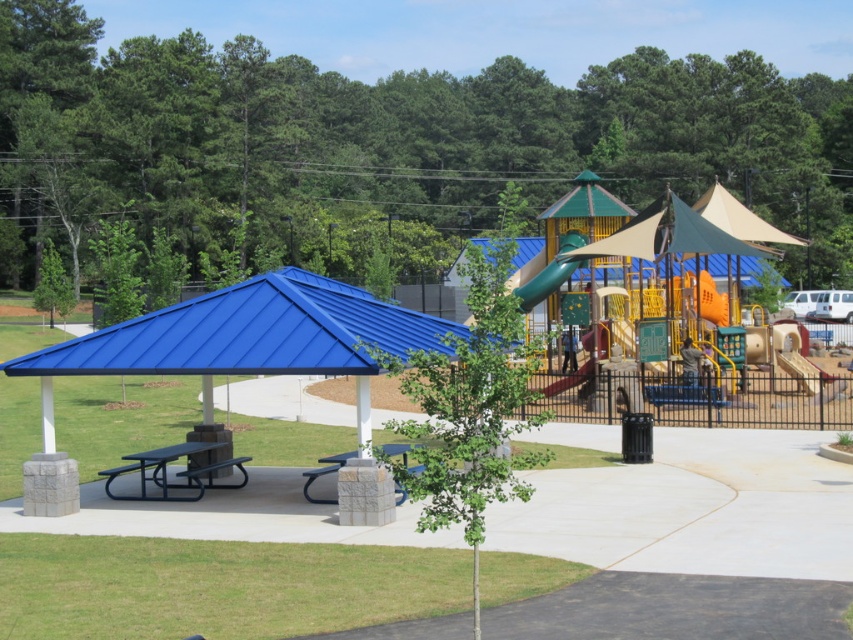
Who is more forward, (196, 467) or (578, 237)?

Positioned in front is point (196, 467).

Does blue metal picnic table at lower left have a greater width compared to green matte slide at center?

Incorrect, blue metal picnic table at lower left's width does not surpass green matte slide at center's.

Between point (206, 468) and point (563, 244), which one is positioned behind?

The point (563, 244) is more distant.

The height and width of the screenshot is (640, 853). In order to click on blue metal picnic table at lower left in this screenshot , I will do `click(175, 472)`.

Between stone textured picnic table at center and smooth green slide at center, which one is positioned lower?

stone textured picnic table at center is below.

Measure the distance between stone textured picnic table at center and smooth green slide at center.

14.34 meters

This screenshot has height=640, width=853. I want to click on stone textured picnic table at center, so click(325, 474).

Is blue metal canopy at left above smooth green slide at center?

Indeed, blue metal canopy at left is positioned over smooth green slide at center.

This screenshot has height=640, width=853. I want to click on blue metal canopy at left, so click(x=247, y=339).